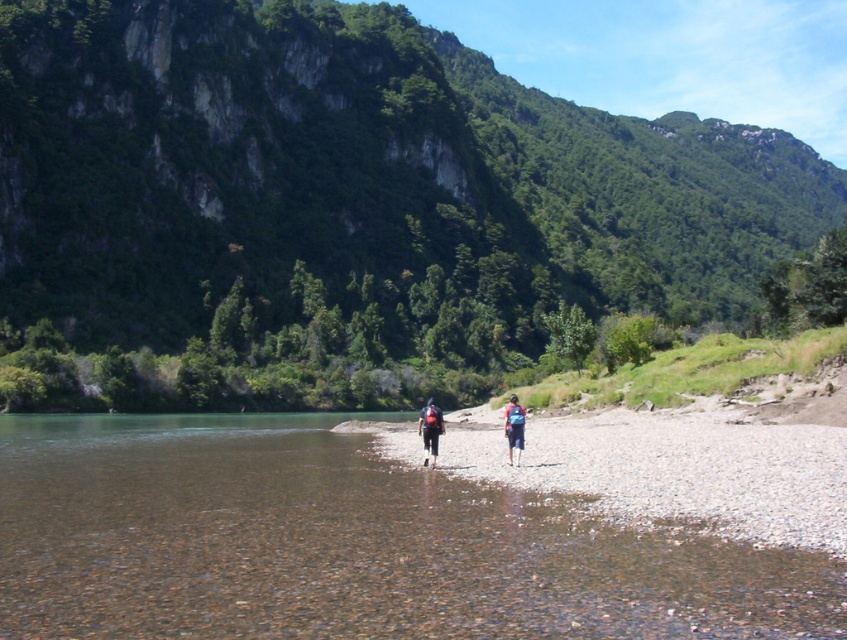
Is point (123, 593) less distant than point (515, 397)?

Yes, point (123, 593) is in front of point (515, 397).

Between point (710, 632) and point (513, 445), which one is positioned behind?

The point (513, 445) is more distant.

Which is in front, point (366, 588) or point (502, 426)?

Point (366, 588) is more forward.

You are a GUI agent. You are given a task and a screenshot of the screen. Output one action in this format:
    pyautogui.click(x=<x>, y=<y>)
    Task: Click on the clear water at river center
    
    Given the screenshot: What is the action you would take?
    (346, 545)

You are a GUI agent. You are given a task and a screenshot of the screen. Output one action in this format:
    pyautogui.click(x=<x>, y=<y>)
    Task: Click on the matte black backpack at center
    Image resolution: width=847 pixels, height=640 pixels.
    Given the screenshot: What is the action you would take?
    pyautogui.click(x=430, y=429)

I want to click on matte black backpack at center, so click(430, 429).

Does blue fabric backpacks at center appear under blue fabric backpack at center?

Indeed, blue fabric backpacks at center is positioned under blue fabric backpack at center.

Which is in front, point (524, 406) or point (516, 396)?

Positioned in front is point (524, 406).

The image size is (847, 640). I want to click on blue fabric backpacks at center, so click(x=430, y=429).